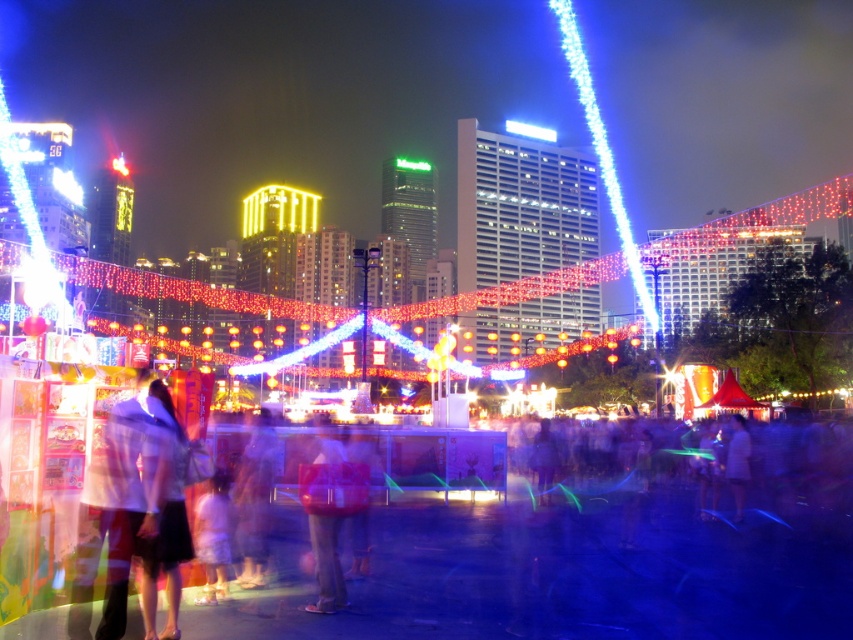
Consider the image. Does light pink fabric dress at center have a lesser height compared to light brown fabric shirt at center?

Incorrect, light pink fabric dress at center's height does not fall short of light brown fabric shirt at center's.

At what (x,y) coordinates should I click in order to perform the action: click on light pink fabric dress at center. Please return your answer as a coordinate pair (x, y). This screenshot has height=640, width=853. Looking at the image, I should click on (326, 563).

Does light pink fabric dress at center have a greater width compared to translucent plastic bag at center?

Correct, the width of light pink fabric dress at center exceeds that of translucent plastic bag at center.

Does light pink fabric dress at center have a greater height compared to translucent plastic bag at center?

Yes.

Is point (332, 444) behind point (548, 449)?

No, (332, 444) is in front of (548, 449).

Locate an element on the screen. light pink fabric dress at center is located at coordinates (326, 563).

Can you confirm if light brown fabric shirt at center is bigger than translucent plastic bag at center?

Yes, light brown fabric shirt at center is bigger than translucent plastic bag at center.

Does light brown fabric shirt at center have a greater height compared to translucent plastic bag at center?

Yes.

Does point (741, 488) lie in front of point (549, 483)?

Yes, point (741, 488) is closer to viewer.

Image resolution: width=853 pixels, height=640 pixels. I want to click on light brown fabric shirt at center, so click(737, 461).